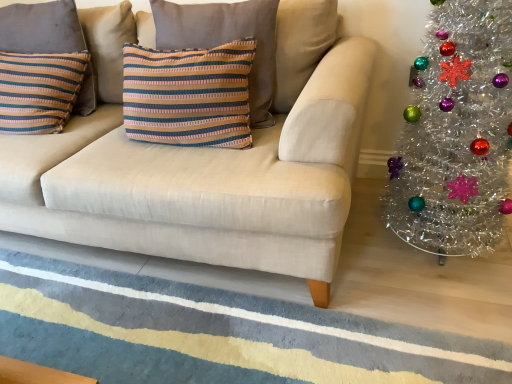
Question: Does beige fabric couch at center have a larger size compared to tinsel silver christmas tree at right?

Choices:
 (A) yes
 (B) no

Answer: (A)

Question: Is beige fabric couch at center closer to the viewer compared to tinsel silver christmas tree at right?

Choices:
 (A) yes
 (B) no

Answer: (A)

Question: Considering the relative positions of beige fabric couch at center and tinsel silver christmas tree at right in the image provided, is beige fabric couch at center to the left of tinsel silver christmas tree at right from the viewer's perspective?

Choices:
 (A) no
 (B) yes

Answer: (B)

Question: Would you consider beige fabric couch at center to be distant from tinsel silver christmas tree at right?

Choices:
 (A) yes
 (B) no

Answer: (B)

Question: Considering the relative sizes of beige fabric couch at center and tinsel silver christmas tree at right in the image provided, is beige fabric couch at center thinner than tinsel silver christmas tree at right?

Choices:
 (A) no
 (B) yes

Answer: (A)

Question: From a real-world perspective, is beige fabric couch at center on top of tinsel silver christmas tree at right?

Choices:
 (A) no
 (B) yes

Answer: (B)

Question: Can you confirm if beige fabric couch at center is taller than textured wool rug at lower center?

Choices:
 (A) yes
 (B) no

Answer: (A)

Question: Considering the relative sizes of beige fabric couch at center and textured wool rug at lower center in the image provided, is beige fabric couch at center bigger than textured wool rug at lower center?

Choices:
 (A) no
 (B) yes

Answer: (B)

Question: Does beige fabric couch at center touch textured wool rug at lower center?

Choices:
 (A) no
 (B) yes

Answer: (A)

Question: Can you confirm if beige fabric couch at center is wider than textured wool rug at lower center?

Choices:
 (A) yes
 (B) no

Answer: (B)

Question: Considering the relative positions of beige fabric couch at center and textured wool rug at lower center in the image provided, is beige fabric couch at center to the left of textured wool rug at lower center from the viewer's perspective?

Choices:
 (A) no
 (B) yes

Answer: (B)

Question: Considering the relative sizes of beige fabric couch at center and textured wool rug at lower center in the image provided, is beige fabric couch at center thinner than textured wool rug at lower center?

Choices:
 (A) yes
 (B) no

Answer: (A)

Question: Considering the relative sizes of striped fabric pillow at left, marked as the second pillow in a right-to-left arrangement, and striped fabric pillow at center, the 2th pillow in the left-to-right sequence, in the image provided, is striped fabric pillow at left, marked as the second pillow in a right-to-left arrangement, wider than striped fabric pillow at center, the 2th pillow in the left-to-right sequence,?

Choices:
 (A) yes
 (B) no

Answer: (B)